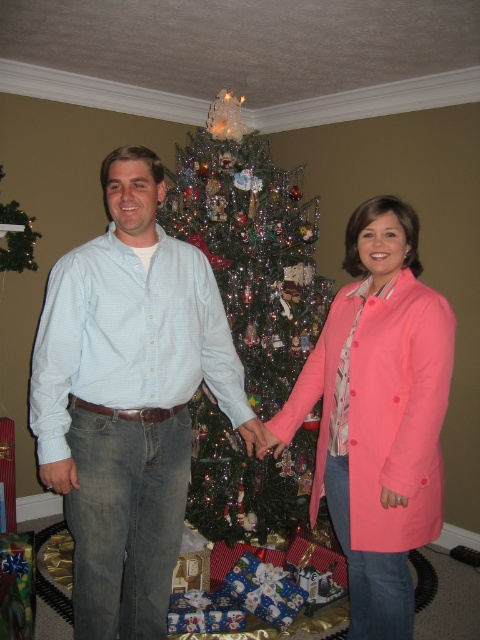
Question: Which object is closer to the camera taking this photo?

Choices:
 (A) coral fabric coat at center
 (B) light blue button-down shirt at center

Answer: (B)

Question: Where is light blue button-down shirt at center located in relation to coral fabric coat at center in the image?

Choices:
 (A) right
 (B) left

Answer: (B)

Question: Among these objects, which one is farthest from the camera?

Choices:
 (A) light blue button-down shirt at center
 (B) green metallic christmas tree at center
 (C) coral fabric coat at center

Answer: (B)

Question: Which point is closer to the camera?

Choices:
 (A) (111, 493)
 (B) (212, 445)
 (C) (382, 429)

Answer: (A)

Question: Does coral fabric coat at center appear on the right side of green metallic christmas tree at center?

Choices:
 (A) yes
 (B) no

Answer: (A)

Question: Does coral fabric coat at center have a larger size compared to green metallic christmas tree at center?

Choices:
 (A) yes
 (B) no

Answer: (B)